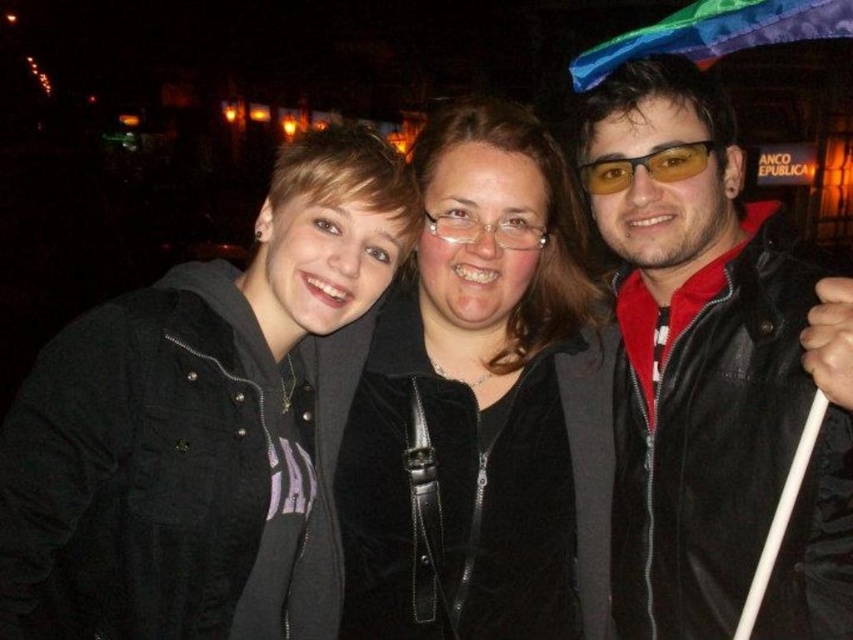
Who is more forward, (636, 392) or (605, 188)?

Point (605, 188) is in front.

Identify the location of matte black jacket at right. (712, 372).

Who is shorter, matte black jacket at right or velvet black jacket at center?

velvet black jacket at center

Can you confirm if matte black jacket at right is thinner than velvet black jacket at center?

Correct, matte black jacket at right's width is less than velvet black jacket at center's.

This screenshot has width=853, height=640. What do you see at coordinates (712, 372) in the screenshot?
I see `matte black jacket at right` at bounding box center [712, 372].

You are a GUI agent. You are given a task and a screenshot of the screen. Output one action in this format:
    pyautogui.click(x=<x>, y=<y>)
    Task: Click on the matte black jacket at right
    The height and width of the screenshot is (640, 853).
    Given the screenshot: What is the action you would take?
    pyautogui.click(x=712, y=372)

Does velvet black jacket at center appear under yellow tinted plastic glasses at center?

Yes.

Describe the element at coordinates (474, 403) in the screenshot. I see `velvet black jacket at center` at that location.

Where is `velvet black jacket at center`? The width and height of the screenshot is (853, 640). velvet black jacket at center is located at coordinates (474, 403).